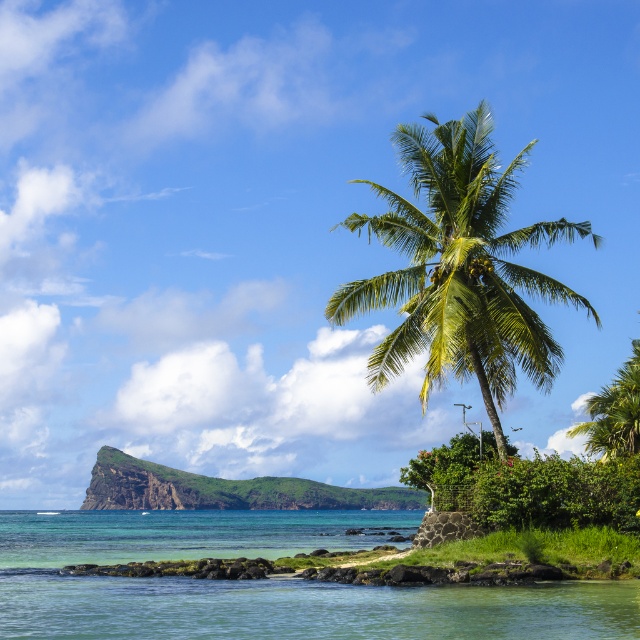
Does point (301, 512) come in front of point (362, 225)?

No, it is behind (362, 225).

Is point (593, 627) positioned in front of point (531, 145)?

Yes, point (593, 627) is in front of point (531, 145).

At what (x,y) coordinates should I click in order to perform the action: click on clear blue water at lower left. Please return your answer as a coordinate pair (x, y). This screenshot has width=640, height=640. Looking at the image, I should click on (266, 582).

Describe the element at coordinates (266, 582) in the screenshot. I see `clear blue water at lower left` at that location.

How much distance is there between clear blue water at lower left and green rocky island at center?

clear blue water at lower left and green rocky island at center are 79.93 meters apart from each other.

Locate an element on the screen. This screenshot has width=640, height=640. clear blue water at lower left is located at coordinates (266, 582).

Identify the location of clear blue water at lower left. Image resolution: width=640 pixels, height=640 pixels. (266, 582).

Does green leafy coconut tree at center have a lesser width compared to green rocky island at center?

Yes, green leafy coconut tree at center is thinner than green rocky island at center.

Between point (420, 307) and point (326, 492), which one is positioned behind?

Positioned behind is point (326, 492).

Does point (417, 141) lie in front of point (266, 486)?

Yes, it is in front of point (266, 486).

Identify the location of green leafy coconut tree at center. (460, 268).